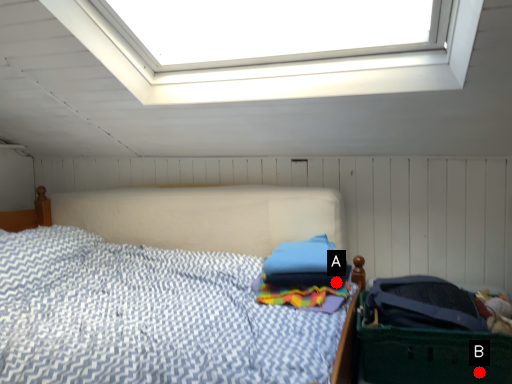
Question: Two points are circled on the image, labeled by A and B beside each circle. Which point is further to the camera?

Choices:
 (A) A is further
 (B) B is further

Answer: (A)